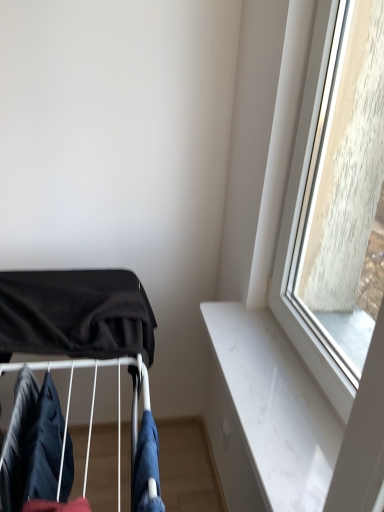
Question: Does denim fabric at lower center, which is the 1th clothing from right to left, have a lesser height compared to dark blue fabric at lower left, arranged as the 2th clothing when viewed from the right?

Choices:
 (A) yes
 (B) no

Answer: (A)

Question: Can you confirm if denim fabric at lower center, the third clothing when ordered from left to right, is taller than dark blue fabric at lower left, arranged as the 2th clothing when viewed from the right?

Choices:
 (A) yes
 (B) no

Answer: (B)

Question: Is denim fabric at lower center, the third clothing when ordered from left to right, to the right of dark blue fabric at lower left, the 2th clothing positioned from the left, from the viewer's perspective?

Choices:
 (A) yes
 (B) no

Answer: (A)

Question: From the image's perspective, does denim fabric at lower center, the third clothing when ordered from left to right, appear lower than dark blue fabric at lower left, arranged as the 2th clothing when viewed from the right?

Choices:
 (A) yes
 (B) no

Answer: (A)

Question: Is denim fabric at lower center, the third clothing when ordered from left to right, smaller than dark blue fabric at lower left, the 2th clothing positioned from the left?

Choices:
 (A) yes
 (B) no

Answer: (A)

Question: From the image's perspective, relative to black fabric baby carriage at left, is dark blue fabric at lower left, positioned as the 3th clothing in right-to-left order, above or below?

Choices:
 (A) below
 (B) above

Answer: (A)

Question: In the image, is dark blue fabric at lower left, positioned as the 3th clothing in right-to-left order, positioned in front of or behind black fabric baby carriage at left?

Choices:
 (A) front
 (B) behind

Answer: (A)

Question: From their relative heights in the image, would you say dark blue fabric at lower left, the 1th clothing in the left-to-right sequence, is taller or shorter than black fabric baby carriage at left?

Choices:
 (A) short
 (B) tall

Answer: (A)

Question: In terms of size, does dark blue fabric at lower left, positioned as the 3th clothing in right-to-left order, appear bigger or smaller than black fabric baby carriage at left?

Choices:
 (A) big
 (B) small

Answer: (B)

Question: From a real-world perspective, is dark blue fabric at lower left, the 2th clothing positioned from the left, positioned above or below black fabric baby carriage at left?

Choices:
 (A) above
 (B) below

Answer: (B)

Question: Considering the positions of dark blue fabric at lower left, the 2th clothing positioned from the left, and black fabric baby carriage at left in the image, is dark blue fabric at lower left, the 2th clothing positioned from the left, wider or thinner than black fabric baby carriage at left?

Choices:
 (A) wide
 (B) thin

Answer: (B)

Question: Is point (57, 471) closer or farther from the camera than point (8, 343)?

Choices:
 (A) farther
 (B) closer

Answer: (B)

Question: Is dark blue fabric at lower left, the 2th clothing positioned from the left, in front of or behind black fabric baby carriage at left in the image?

Choices:
 (A) front
 (B) behind

Answer: (A)

Question: From the image's perspective, is black fabric baby carriage at left positioned above or below dark blue fabric at lower left, positioned as the 3th clothing in right-to-left order?

Choices:
 (A) below
 (B) above

Answer: (B)

Question: From a real-world perspective, is black fabric baby carriage at left physically located above or below dark blue fabric at lower left, positioned as the 3th clothing in right-to-left order?

Choices:
 (A) above
 (B) below

Answer: (A)